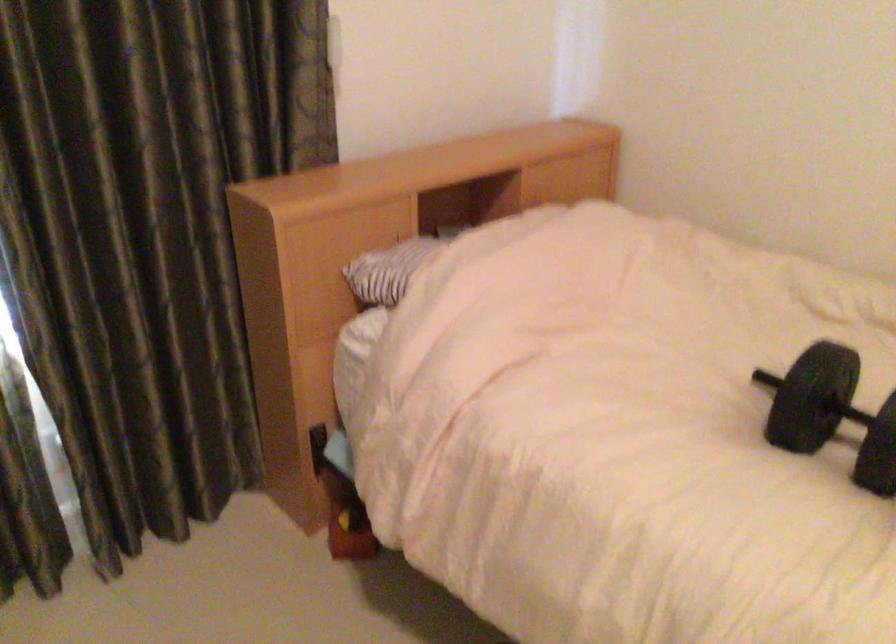
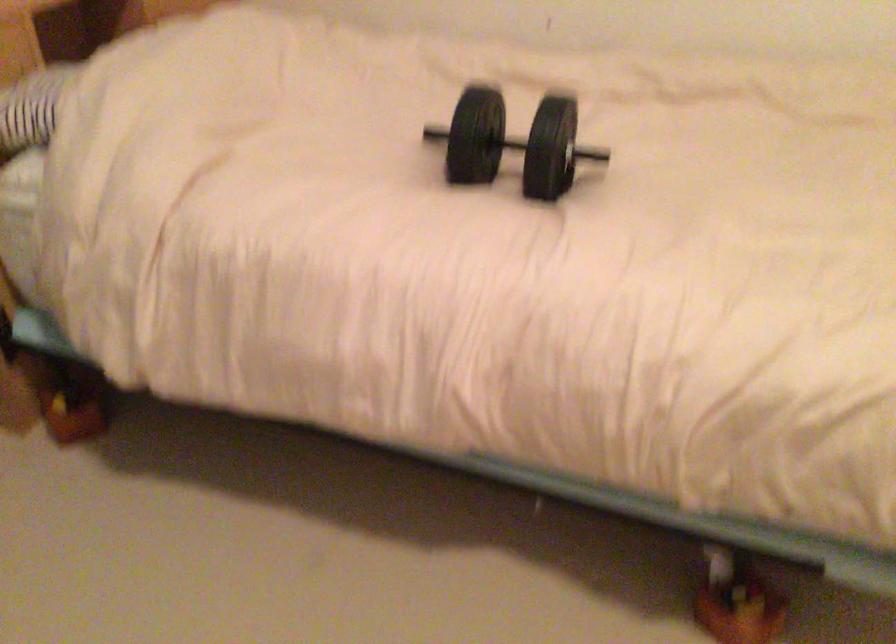
Question: What movement of the cameraman would produce the second image?

Choices:
 (A) Left
 (B) Right
 (C) Forward
 (D) Backward

Answer: (A)